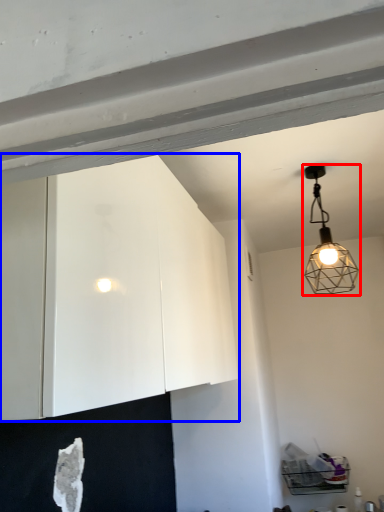
Question: Which point is closer to the camera, lamp (highlighted by a red box) or cabinetry (highlighted by a blue box)?

Choices:
 (A) lamp
 (B) cabinetry

Answer: (B)